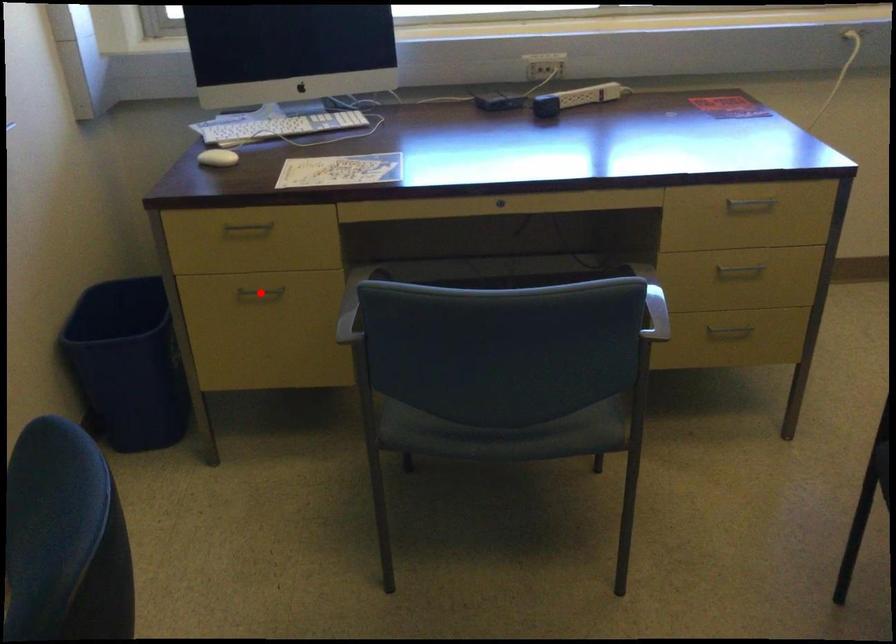
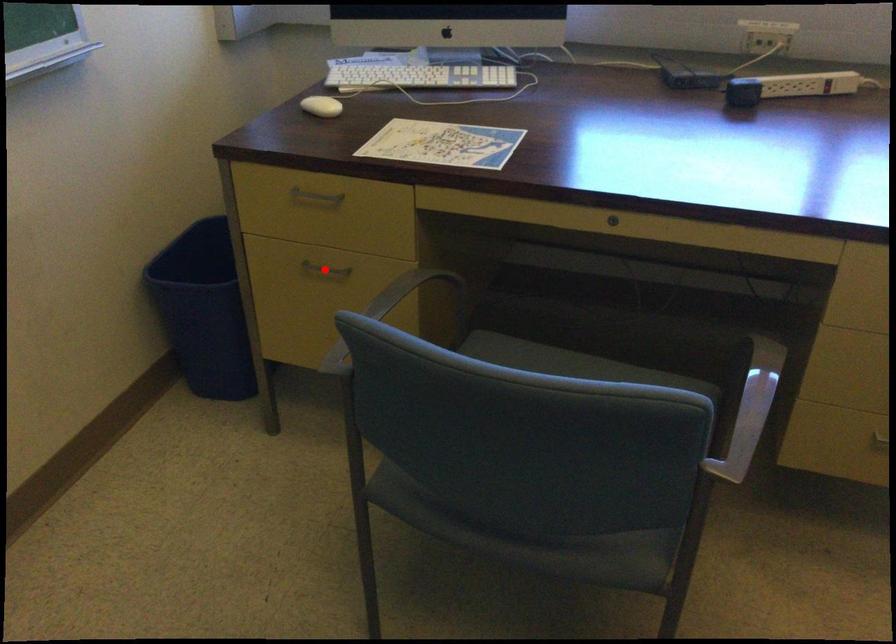
I am providing you with two images of the same scene from different viewpoints. A red point is marked on the first image and another point is marked on the second image. Do the highlighted points in image1 and image2 indicate the same real-world spot?

Yes